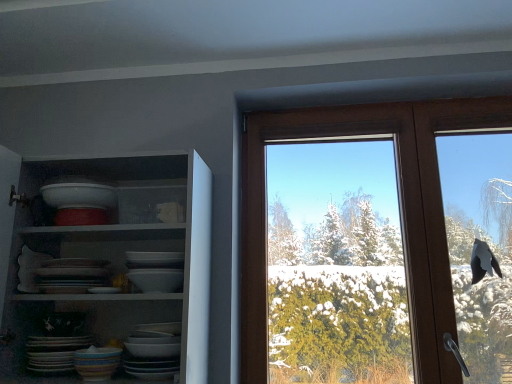
Question: Would you say multicolored ceramic bowl at lower left is inside or outside white glossy shelves at upper left?

Choices:
 (A) outside
 (B) inside

Answer: (B)

Question: Is multicolored ceramic bowl at lower left bigger or smaller than white glossy shelves at upper left?

Choices:
 (A) small
 (B) big

Answer: (A)

Question: Estimate the real-world distances between objects in this image. Which object is closer to the white glossy shelves at upper left?

Choices:
 (A) matte ceramic platter at lower left
 (B) brown wooden window at upper right
 (C) multicolored ceramic bowl at lower left

Answer: (A)

Question: Which object is positioned closest to the matte ceramic platter at lower left?

Choices:
 (A) white glossy shelves at upper left
 (B) brown wooden window at upper right
 (C) multicolored ceramic bowl at lower left

Answer: (C)